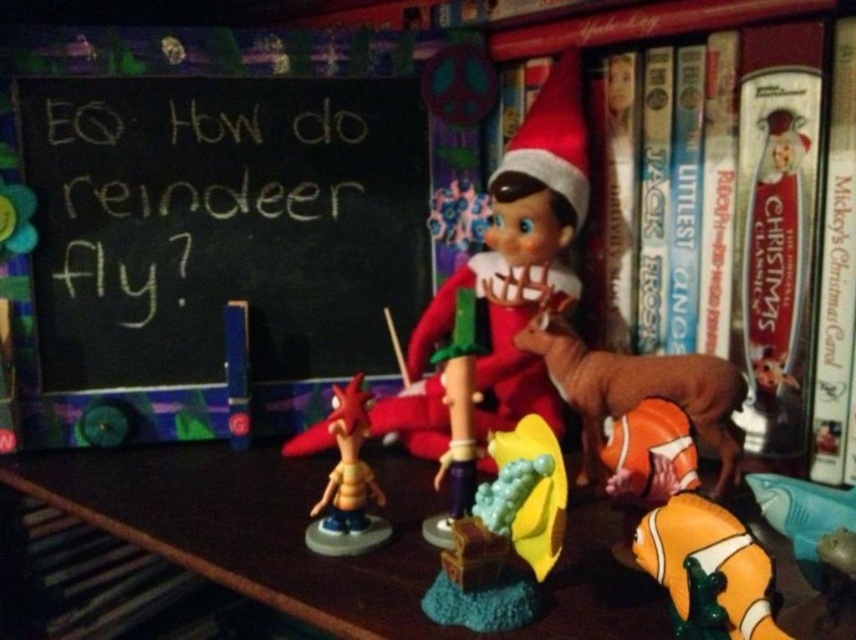
Is point (449, 636) positioned in front of point (800, 54)?

That is True.

Consider the image. Is wooden table at center bigger than wooden bookshelf at upper right?

Yes.

Measure the distance between point (617, 636) and camera.

Point (617, 636) is 22.07 inches from camera.

You are a GUI agent. You are given a task and a screenshot of the screen. Output one action in this format:
    pyautogui.click(x=<x>, y=<y>)
    Task: Click on the wooden table at center
    This screenshot has width=856, height=640.
    Given the screenshot: What is the action you would take?
    point(317,556)

What do you see at coordinates (504, 536) in the screenshot? I see `yellow rubber duck at center` at bounding box center [504, 536].

Is yellow rubber duck at center above brown matte reindeer at center-right?

Incorrect, yellow rubber duck at center is not positioned above brown matte reindeer at center-right.

Between point (516, 532) and point (563, 355), which one is positioned behind?

The point (563, 355) is behind.

You are a GUI agent. You are given a task and a screenshot of the screen. Output one action in this format:
    pyautogui.click(x=<x>, y=<y>)
    Task: Click on the yellow rubber duck at center
    The image size is (856, 640).
    Given the screenshot: What is the action you would take?
    pyautogui.click(x=504, y=536)

Between black chalkboard at upper left and wooden bookshelf at upper right, which one is positioned higher?

Positioned higher is wooden bookshelf at upper right.

Who is more forward, (147, 396) or (645, 198)?

Positioned in front is point (645, 198).

Is point (317, 198) closer to viewer compared to point (611, 320)?

No, (317, 198) is further to viewer.

Identify the location of black chalkboard at upper left. (217, 248).